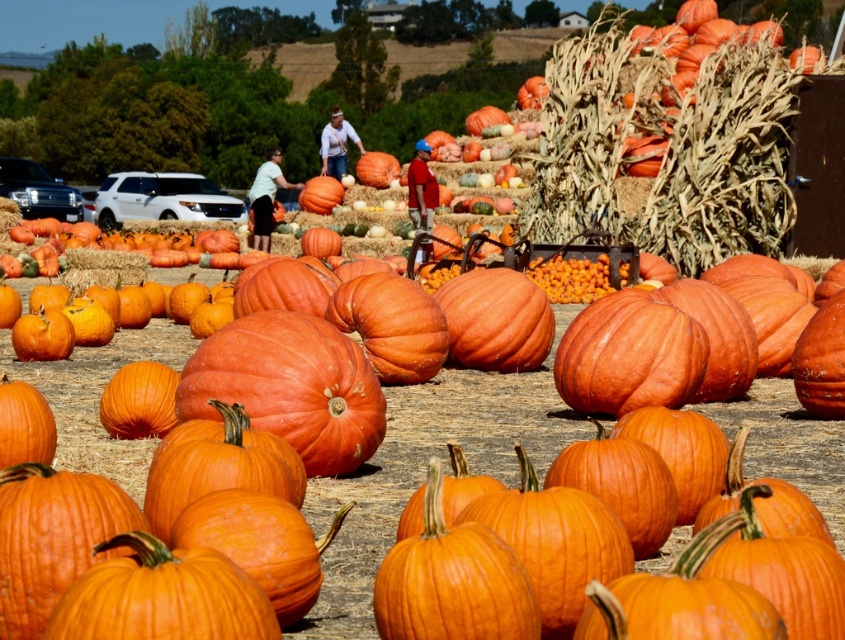
In the scene shown: You are standing in the pumpkin patch and want to place a scarecrow at the exact center of the image. The scarecrow must be placed such that it is equidistant from the textured straw bale at upper right and the nearest pumpkin in the foreground. Is this possible?

The textured straw bale at upper right is located at point (668, 148). To determine if the scarecrow can be placed equidistant from it and the nearest pumpkin in the foreground, we need to know the coordinates of the nearest pumpkin. Since the coordinates of the nearest pumpkin are not provided, we cannot confirm if such a placement is possible.

You are standing in the pumpkin patch and want to place a decorative gourd on the highest point between the textured straw bale at upper right and the orange matte pumpkin at center. Which object should you choose?

The textured straw bale at upper right is above the orange matte pumpkin at center, so you should place the decorative gourd on the textured straw bale at upper right.